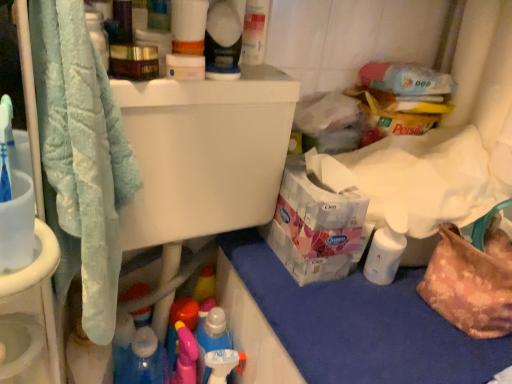
Question: Could white glossy lotion at lower right be considered to be inside soft blue towel at left?

Choices:
 (A) yes
 (B) no

Answer: (B)

Question: Is soft blue towel at left far away from white glossy lotion at lower right?

Choices:
 (A) no
 (B) yes

Answer: (A)

Question: From a real-world perspective, is soft blue towel at left beneath white glossy lotion at lower right?

Choices:
 (A) yes
 (B) no

Answer: (B)

Question: Is soft blue towel at left wider than white glossy lotion at lower right?

Choices:
 (A) yes
 (B) no

Answer: (A)

Question: From a real-world perspective, is soft blue towel at left on top of white glossy lotion at lower right?

Choices:
 (A) no
 (B) yes

Answer: (B)

Question: Considering the relative sizes of soft blue towel at left and white glossy lotion at lower right in the image provided, is soft blue towel at left thinner than white glossy lotion at lower right?

Choices:
 (A) no
 (B) yes

Answer: (A)

Question: Is soft blue towel at left a part of floral fabric handbag at lower right?

Choices:
 (A) no
 (B) yes

Answer: (A)

Question: Considering the relative sizes of floral fabric handbag at lower right and soft blue towel at left in the image provided, is floral fabric handbag at lower right taller than soft blue towel at left?

Choices:
 (A) no
 (B) yes

Answer: (A)

Question: Is the position of floral fabric handbag at lower right more distant than that of soft blue towel at left?

Choices:
 (A) yes
 (B) no

Answer: (A)

Question: Is floral fabric handbag at lower right facing towards soft blue towel at left?

Choices:
 (A) yes
 (B) no

Answer: (B)

Question: Can you confirm if floral fabric handbag at lower right is wider than soft blue towel at left?

Choices:
 (A) no
 (B) yes

Answer: (A)

Question: From the image's perspective, is floral fabric handbag at lower right under soft blue towel at left?

Choices:
 (A) yes
 (B) no

Answer: (A)

Question: Is white glossy lotion at lower right wider than matte white spray bottle at upper center?

Choices:
 (A) yes
 (B) no

Answer: (B)